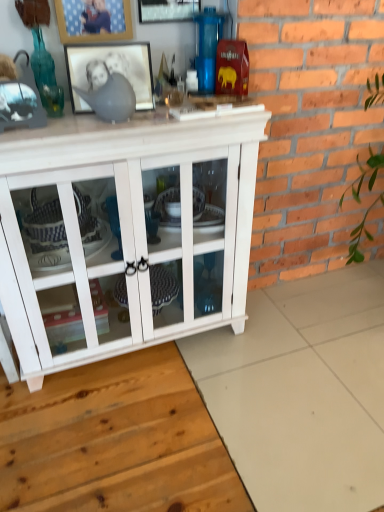
In order to face white wood cabinet at center, should I rotate leftwards or rightwards?

Turn left approximately 9.278 degrees to face it.

Identify the location of white wood cabinet at center. The width and height of the screenshot is (384, 512). (126, 230).

Which is nearer, (61, 221) or (121, 65)?

The point (121, 65) is closer to the camera.

How much distance is there between white wood cabinet at center and black matte picture frame at upper center, which is counted as the third picture frame, starting from the top?

A distance of 16.36 inches exists between white wood cabinet at center and black matte picture frame at upper center, which is counted as the third picture frame, starting from the top.

Could you tell me if white wood cabinet at center is facing black matte picture frame at upper center, which is counted as the third picture frame, starting from the top?

No, white wood cabinet at center is not facing towards black matte picture frame at upper center, which is counted as the third picture frame, starting from the top.

How different are the orientations of white wood cabinet at center and black matte picture frame at upper center, which is counted as the third picture frame, starting from the top, in degrees?

They differ by 10.2 degrees in their facing directions.

Between black matte picture frame at upper center, which ranks as the 1th picture frame in bottom-to-top order, and wooden picture frame at upper center, which ranks as the second picture frame in top-to-bottom order, which one appears on the left side from the viewer's perspective?

Positioned to the left is wooden picture frame at upper center, which ranks as the second picture frame in top-to-bottom order.

Between point (95, 71) and point (126, 14), which one is positioned in front?

Point (95, 71)

Which of these two, black matte picture frame at upper center, which is counted as the third picture frame, starting from the top, or wooden picture frame at upper center, the second picture frame in the bottom-to-top sequence, stands shorter?

With less height is black matte picture frame at upper center, which is counted as the third picture frame, starting from the top.

How much distance is there between black matte picture frame at upper center, which is counted as the third picture frame, starting from the top, and wooden picture frame at upper center, which ranks as the second picture frame in top-to-bottom order?

black matte picture frame at upper center, which is counted as the third picture frame, starting from the top, and wooden picture frame at upper center, which ranks as the second picture frame in top-to-bottom order, are 5.10 inches apart from each other.

Based on their positions, is wooden picture frame at upper center, the second picture frame in the bottom-to-top sequence, located to the left or right of white wood cabinet at center?

Based on their positions, wooden picture frame at upper center, the second picture frame in the bottom-to-top sequence, is located to the left of white wood cabinet at center.

Is wooden picture frame at upper center, the second picture frame in the bottom-to-top sequence, further to the viewer compared to white wood cabinet at center?

Yes, wooden picture frame at upper center, the second picture frame in the bottom-to-top sequence, is further from the camera.

Who is bigger, wooden picture frame at upper center, which ranks as the second picture frame in top-to-bottom order, or white wood cabinet at center?

With larger size is white wood cabinet at center.

Is black matte picture frame at upper center, which ranks as the 1th picture frame in bottom-to-top order, touching white wood cabinet at center?

There is a gap between black matte picture frame at upper center, which ranks as the 1th picture frame in bottom-to-top order, and white wood cabinet at center.

Does black matte picture frame at upper center, which ranks as the 1th picture frame in bottom-to-top order, turn towards white wood cabinet at center?

No, black matte picture frame at upper center, which ranks as the 1th picture frame in bottom-to-top order, does not turn towards white wood cabinet at center.

Which of these two, black matte picture frame at upper center, which is counted as the third picture frame, starting from the top, or white wood cabinet at center, stands taller?

Standing taller between the two is white wood cabinet at center.

Considering the positions of objects black matte picture frame at upper center, which ranks as the 1th picture frame in bottom-to-top order, and white wood cabinet at center in the image provided, who is behind, black matte picture frame at upper center, which ranks as the 1th picture frame in bottom-to-top order, or white wood cabinet at center?

black matte picture frame at upper center, which ranks as the 1th picture frame in bottom-to-top order, is further from the camera.

Is white wood cabinet at center spatially inside wooden picture frame at upper center, the second picture frame in the bottom-to-top sequence, or outside of it?

white wood cabinet at center is not enclosed by wooden picture frame at upper center, the second picture frame in the bottom-to-top sequence.

Is there a large distance between white wood cabinet at center and wooden picture frame at upper center, the second picture frame in the bottom-to-top sequence?

No, there isn't a large distance between white wood cabinet at center and wooden picture frame at upper center, the second picture frame in the bottom-to-top sequence.

Measure the distance between white wood cabinet at center and wooden picture frame at upper center, which ranks as the second picture frame in top-to-bottom order.

The distance of white wood cabinet at center from wooden picture frame at upper center, which ranks as the second picture frame in top-to-bottom order, is 26.44 inches.

Is point (102, 176) closer or farther from the camera than point (97, 31)?

Point (102, 176).

Based on the photo, considering the sizes of objects metallic silver picture frame at upper center, which appears as the 1th picture frame when viewed from the top, and black matte picture frame at upper center, which is counted as the third picture frame, starting from the top, in the image provided, who is bigger, metallic silver picture frame at upper center, which appears as the 1th picture frame when viewed from the top, or black matte picture frame at upper center, which is counted as the third picture frame, starting from the top,?

black matte picture frame at upper center, which is counted as the third picture frame, starting from the top.

From a real-world perspective, who is located higher, metallic silver picture frame at upper center, which appears as the 1th picture frame when viewed from the top, or black matte picture frame at upper center, which is counted as the third picture frame, starting from the top?

From a 3D spatial view, metallic silver picture frame at upper center, which appears as the 1th picture frame when viewed from the top, is above.

Can you confirm if metallic silver picture frame at upper center, which appears as the 1th picture frame when viewed from the top, is positioned to the right of black matte picture frame at upper center, which is counted as the third picture frame, starting from the top?

Yes, metallic silver picture frame at upper center, which appears as the 1th picture frame when viewed from the top, is to the right of black matte picture frame at upper center, which is counted as the third picture frame, starting from the top.

Is metallic silver picture frame at upper center, which appears as the 1th picture frame when viewed from the top, looking in the opposite direction of black matte picture frame at upper center, which is counted as the third picture frame, starting from the top?

No, metallic silver picture frame at upper center, which appears as the 1th picture frame when viewed from the top, is not facing the opposite direction of black matte picture frame at upper center, which is counted as the third picture frame, starting from the top.

Which is in front, point (190, 13) or point (215, 305)?

The point (190, 13) is closer.

Is metallic silver picture frame at upper center, acting as the third picture frame starting from the bottom, shorter than white wood cabinet at center?

Indeed, metallic silver picture frame at upper center, acting as the third picture frame starting from the bottom, has a lesser height compared to white wood cabinet at center.

From the image's perspective, is metallic silver picture frame at upper center, acting as the third picture frame starting from the bottom, on white wood cabinet at center?

Yes, from the image's perspective, metallic silver picture frame at upper center, acting as the third picture frame starting from the bottom, is above white wood cabinet at center.

Where is `cabinetry on the left of black matte picture frame at upper center, which is counted as the third picture frame, starting from the top`? The height and width of the screenshot is (512, 384). cabinetry on the left of black matte picture frame at upper center, which is counted as the third picture frame, starting from the top is located at coordinates (126, 230).

Find the location of a particular element. picture frame below the wooden picture frame at upper center, which ranks as the second picture frame in top-to-bottom order (from the image's perspective) is located at coordinates (110, 70).

From the image, which object appears to be nearer to black matte picture frame at upper center, which is counted as the third picture frame, starting from the top, metallic silver picture frame at upper center, acting as the third picture frame starting from the bottom, or white wood cabinet at center?

metallic silver picture frame at upper center, acting as the third picture frame starting from the bottom, is positioned closer to the anchor black matte picture frame at upper center, which is counted as the third picture frame, starting from the top.

Based on their spatial positions, is metallic silver picture frame at upper center, acting as the third picture frame starting from the bottom, or wooden picture frame at upper center, which ranks as the second picture frame in top-to-bottom order, closer to black matte picture frame at upper center, which is counted as the third picture frame, starting from the top?

Based on the image, wooden picture frame at upper center, which ranks as the second picture frame in top-to-bottom order, appears to be nearer to black matte picture frame at upper center, which is counted as the third picture frame, starting from the top.

Estimate the real-world distances between objects in this image. Which object is closer to white wood cabinet at center, black matte picture frame at upper center, which ranks as the 1th picture frame in bottom-to-top order, or wooden picture frame at upper center, the second picture frame in the bottom-to-top sequence?

Among the two, black matte picture frame at upper center, which ranks as the 1th picture frame in bottom-to-top order, is located nearer to white wood cabinet at center.

Considering their positions, is white wood cabinet at center positioned further to metallic silver picture frame at upper center, which appears as the 1th picture frame when viewed from the top, than wooden picture frame at upper center, the second picture frame in the bottom-to-top sequence?

white wood cabinet at center is further to metallic silver picture frame at upper center, which appears as the 1th picture frame when viewed from the top.

Which object lies nearer to the anchor point metallic silver picture frame at upper center, acting as the third picture frame starting from the bottom, black matte picture frame at upper center, which ranks as the 1th picture frame in bottom-to-top order, or wooden picture frame at upper center, which ranks as the second picture frame in top-to-bottom order?

Based on the image, wooden picture frame at upper center, which ranks as the second picture frame in top-to-bottom order, appears to be nearer to metallic silver picture frame at upper center, acting as the third picture frame starting from the bottom.

Based on their spatial positions, is black matte picture frame at upper center, which is counted as the third picture frame, starting from the top, or metallic silver picture frame at upper center, which appears as the 1th picture frame when viewed from the top, further from wooden picture frame at upper center, the second picture frame in the bottom-to-top sequence?

The object further to wooden picture frame at upper center, the second picture frame in the bottom-to-top sequence, is metallic silver picture frame at upper center, which appears as the 1th picture frame when viewed from the top.

From the image, which object appears to be farther from black matte picture frame at upper center, which is counted as the third picture frame, starting from the top, wooden picture frame at upper center, which ranks as the second picture frame in top-to-bottom order, or metallic silver picture frame at upper center, which appears as the 1th picture frame when viewed from the top?

metallic silver picture frame at upper center, which appears as the 1th picture frame when viewed from the top, is positioned further to the anchor black matte picture frame at upper center, which is counted as the third picture frame, starting from the top.

Which object lies nearer to the anchor point wooden picture frame at upper center, the second picture frame in the bottom-to-top sequence, black matte picture frame at upper center, which is counted as the third picture frame, starting from the top, or white wood cabinet at center?

The object closer to wooden picture frame at upper center, the second picture frame in the bottom-to-top sequence, is black matte picture frame at upper center, which is counted as the third picture frame, starting from the top.

I want to click on picture frame between metallic silver picture frame at upper center, acting as the third picture frame starting from the bottom, and black matte picture frame at upper center, which ranks as the 1th picture frame in bottom-to-top order, from top to bottom, so click(93, 20).

Identify the location of picture frame between wooden picture frame at upper center, the second picture frame in the bottom-to-top sequence, and white wood cabinet at center, in the vertical direction. This screenshot has width=384, height=512. (110, 70).